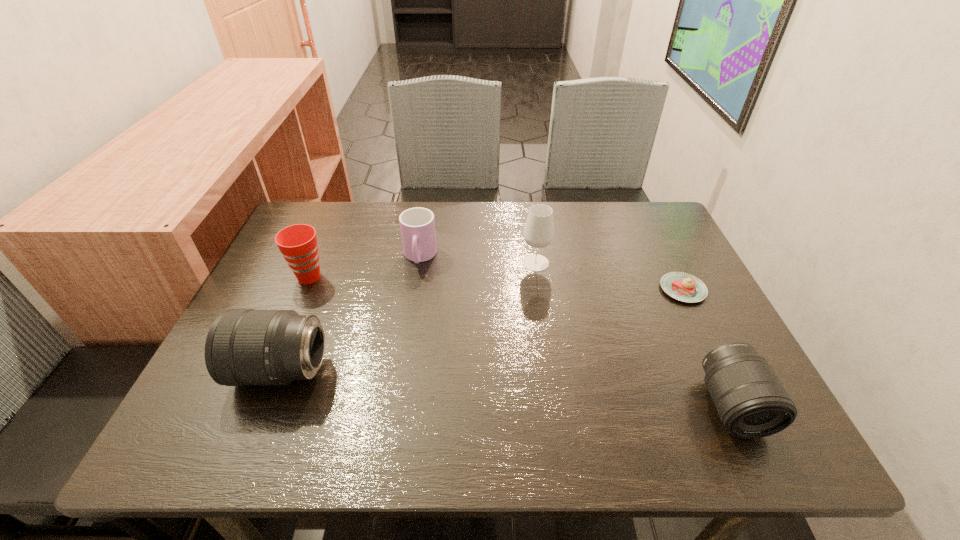
The image size is (960, 540). Find the location of `free space for an extra telephoto_lens to achieve even spacing`. free space for an extra telephoto_lens to achieve even spacing is located at coordinates pyautogui.click(x=499, y=387).